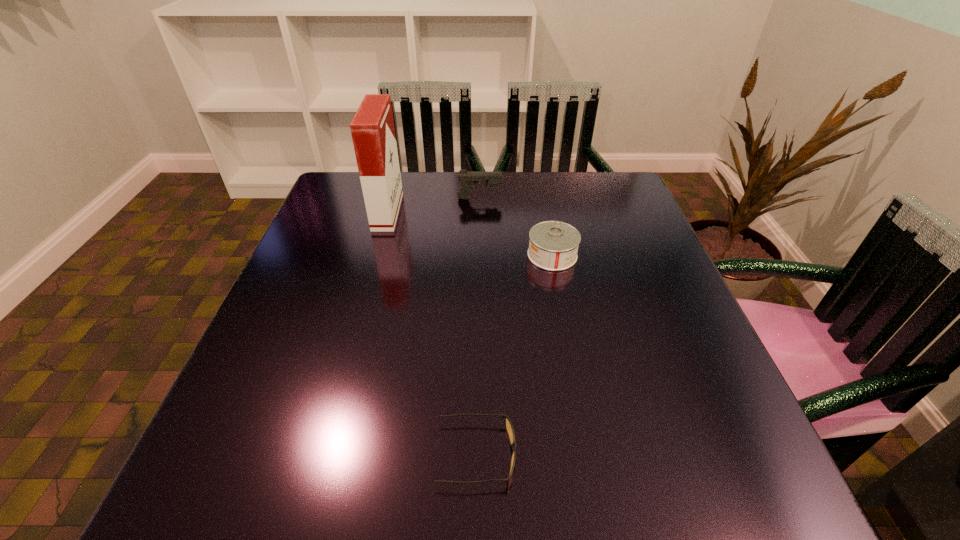
This screenshot has width=960, height=540. In order to click on the leftmost object in this screenshot , I will do `click(372, 128)`.

Locate an element on the screen. cigarette_case is located at coordinates (372, 128).

Where is `pistol`? This screenshot has width=960, height=540. pistol is located at coordinates (469, 179).

The height and width of the screenshot is (540, 960). I want to click on can, so click(553, 245).

Find the location of a particular element. Image resolution: width=960 pixels, height=540 pixels. the rightmost object is located at coordinates (553, 245).

Image resolution: width=960 pixels, height=540 pixels. Identify the location of sunglasses. (509, 428).

I want to click on the shortest object, so click(509, 428).

Identify the location of free location located on the front-facing side of the cigarette_case. pyautogui.click(x=482, y=212).

I want to click on vacant space located 0.240m at the barrel of the second tallest object, so click(589, 198).

Find the location of a particular element. The height and width of the screenshot is (540, 960). blank area located on the front of the rightmost object is located at coordinates (573, 362).